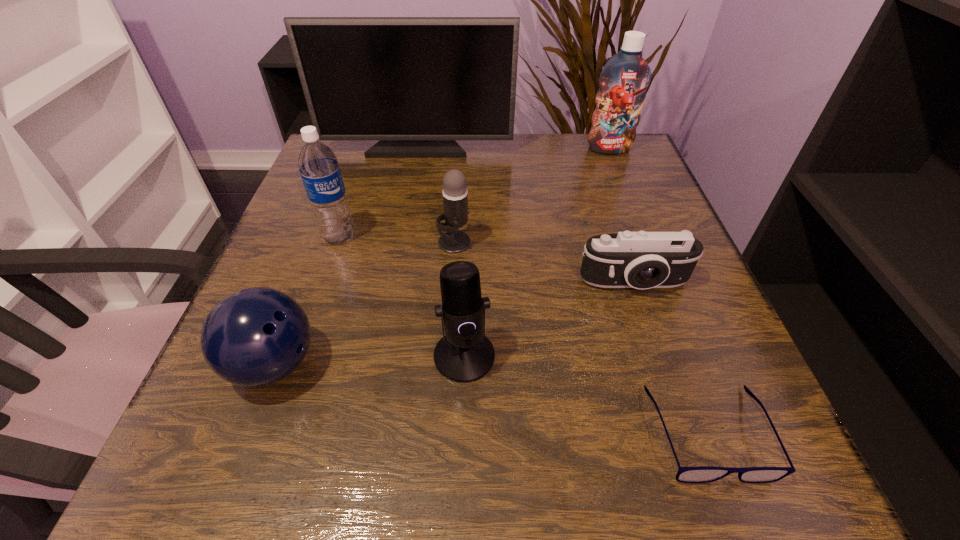
This screenshot has height=540, width=960. Identify the location of monitor. (417, 84).

The image size is (960, 540). Find the location of `shampoo`. shampoo is located at coordinates pos(625,77).

Where is `the third tallest object`? the third tallest object is located at coordinates (318, 165).

Identify the location of the nearer microphone. (464, 354).

Where is `the farther microphone`? the farther microphone is located at coordinates (455, 195).

Identify the location of bowling ball. (254, 337).

You are a GUI agent. You are given a task and a screenshot of the screen. Output one action in this format:
    pyautogui.click(x=<x>, y=<y>)
    Task: Click on the fourth nearest object
    
    Given the screenshot: What is the action you would take?
    pyautogui.click(x=642, y=260)

This screenshot has height=540, width=960. I want to click on camera, so pyautogui.click(x=642, y=260).

I want to click on the shortest object, so click(702, 474).

I want to click on vacant space located on the screen side of the monitor, so click(x=412, y=179).